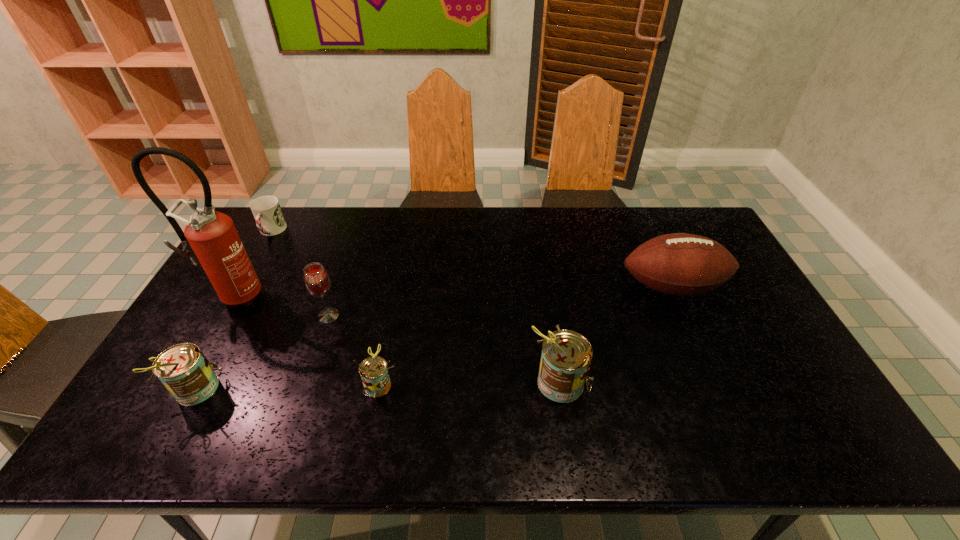
You are a GUI agent. You are given a task and a screenshot of the screen. Output one action in this format:
    pyautogui.click(x=<x>, y=<y>)
    Task: Click on the free space between the wineglass and the shortest can
    Image resolution: width=960 pixels, height=540 pixels.
    Given the screenshot: What is the action you would take?
    pyautogui.click(x=353, y=350)

Where is `free space between the second object from right to left and the farthest object`? The width and height of the screenshot is (960, 540). free space between the second object from right to left and the farthest object is located at coordinates (416, 307).

What are the coordinates of `unoccupied area between the fire extinguisher and the farthest object` in the screenshot? It's located at (253, 264).

The width and height of the screenshot is (960, 540). I want to click on free area in between the shortest can and the farthest object, so click(x=324, y=308).

Locate an element on the screen. The image size is (960, 540). unoccupied position between the leftmost can and the second can from right to left is located at coordinates (287, 387).

You are a GUI agent. You are given a task and a screenshot of the screen. Output one action in this format:
    pyautogui.click(x=<x>, y=<y>)
    Task: Click on the vacant space that's between the football (American) and the fourth object from left to right
    Image resolution: width=960 pixels, height=540 pixels.
    Given the screenshot: What is the action you would take?
    pyautogui.click(x=500, y=301)

This screenshot has width=960, height=540. What are the coordinates of `vacant point located between the fire extinguisher and the fourth object from left to right` in the screenshot? It's located at (282, 306).

In order to click on free space that is in between the farthest object and the football (American) in this screenshot , I will do (471, 259).

Locate an element on the screen. the fourth closest object to the shortest can is located at coordinates (210, 238).

Identify which object is located as the fifth nearest to the second object from right to left. Please provide its 2D coordinates. Your answer should be formatted as a tuple, i.e. [(x, y)], where the tuple contains the x and y coordinates of a point satisfying the conditions above.

[(210, 238)]